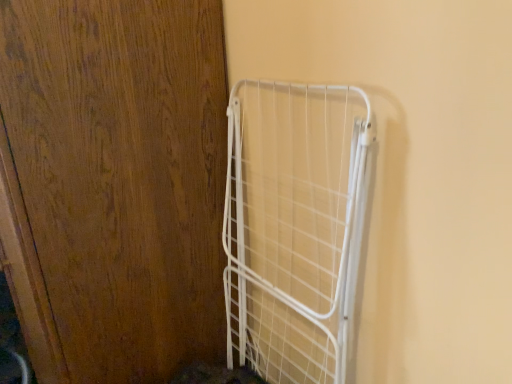
Question: From a real-world perspective, is white wire cage at right located beneath wooden door at left?

Choices:
 (A) no
 (B) yes

Answer: (B)

Question: Does white wire cage at right have a lesser width compared to wooden door at left?

Choices:
 (A) no
 (B) yes

Answer: (B)

Question: Considering the relative sizes of white wire cage at right and wooden door at left in the image provided, is white wire cage at right bigger than wooden door at left?

Choices:
 (A) no
 (B) yes

Answer: (A)

Question: Is white wire cage at right oriented towards wooden door at left?

Choices:
 (A) yes
 (B) no

Answer: (B)

Question: Does white wire cage at right appear on the left side of wooden door at left?

Choices:
 (A) yes
 (B) no

Answer: (B)

Question: Considering the relative positions of white wire cage at right and wooden door at left in the image provided, is white wire cage at right in front of wooden door at left?

Choices:
 (A) no
 (B) yes

Answer: (A)

Question: Does wooden door at left have a greater width compared to white wire cage at right?

Choices:
 (A) no
 (B) yes

Answer: (B)

Question: From a real-world perspective, is wooden door at left below white wire cage at right?

Choices:
 (A) yes
 (B) no

Answer: (B)

Question: Can you confirm if wooden door at left is positioned to the right of white wire cage at right?

Choices:
 (A) yes
 (B) no

Answer: (B)

Question: Is wooden door at left not inside white wire cage at right?

Choices:
 (A) yes
 (B) no

Answer: (A)

Question: Is there a large distance between wooden door at left and white wire cage at right?

Choices:
 (A) no
 (B) yes

Answer: (A)

Question: Considering the relative sizes of wooden door at left and white wire cage at right in the image provided, is wooden door at left shorter than white wire cage at right?

Choices:
 (A) no
 (B) yes

Answer: (A)

Question: From a real-world perspective, relative to white wire cage at right, is wooden door at left vertically above or below?

Choices:
 (A) above
 (B) below

Answer: (A)